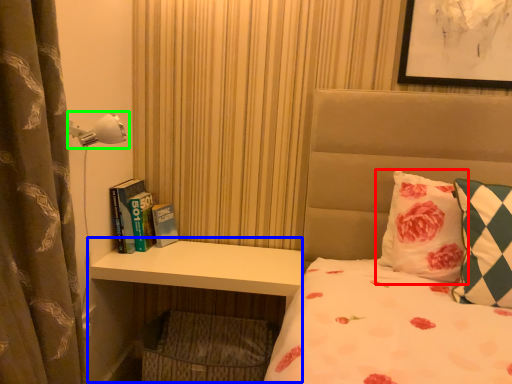
Question: Which object is positioned closest to pillow (highlighted by a red box)? Select from dresser (highlighted by a blue box) and lamp (highlighted by a green box).

Choices:
 (A) dresser
 (B) lamp

Answer: (A)